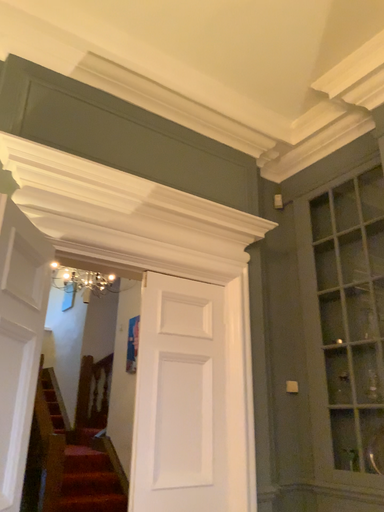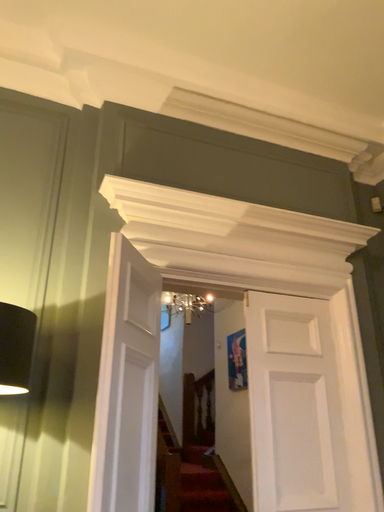
Question: How did the camera likely rotate when shooting the video?

Choices:
 (A) rotated left
 (B) rotated right

Answer: (A)